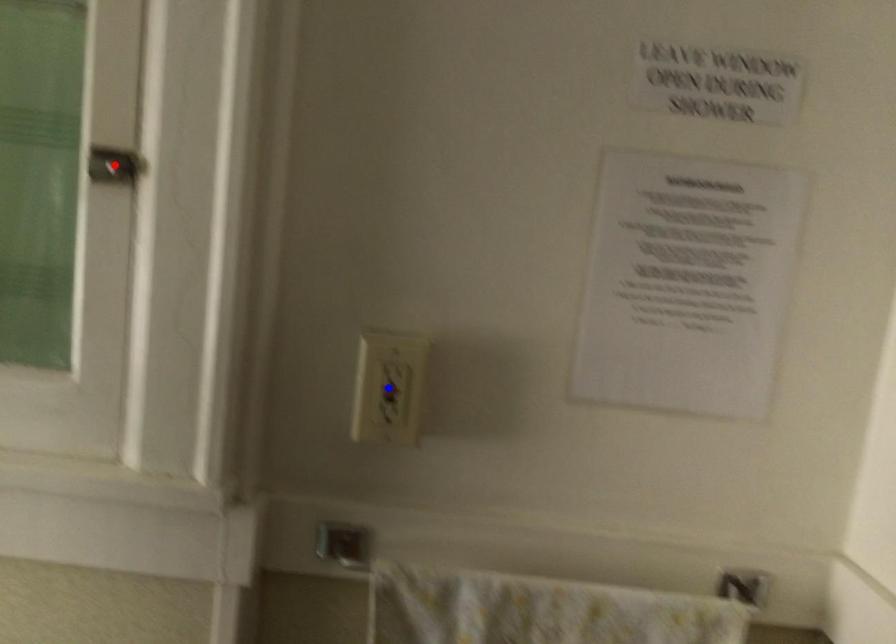
Question: In the image, two points are highlighted. Which point is nearer to the camera? Reply with the corresponding letter.

Choices:
 (A) blue point
 (B) red point

Answer: (B)